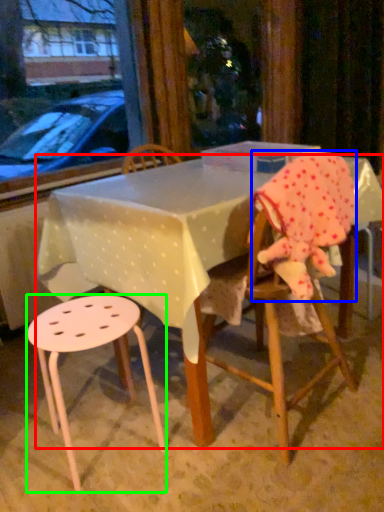
Question: Estimate the real-world distances between objects in this image. Which object is closer to table (highlighted by a red box), toddler (highlighted by a blue box) or stool (highlighted by a green box)?

Choices:
 (A) toddler
 (B) stool

Answer: (B)